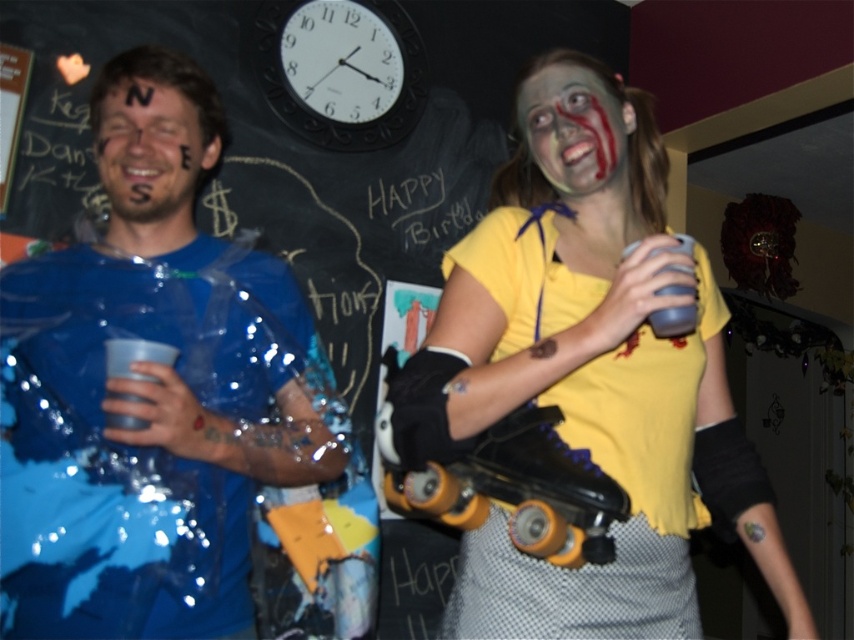
Question: Which object appears closest to the camera in this image?

Choices:
 (A) matte white face at upper right
 (B) blue shiny plastic cup at left

Answer: (B)

Question: Can you confirm if yellow matte shirt at upper right is bigger than yellow rubber roller skate at center?

Choices:
 (A) no
 (B) yes

Answer: (B)

Question: Among these points, which one is nearest to the camera?

Choices:
 (A) (57, 470)
 (B) (471, 284)
 (C) (120, 205)

Answer: (A)

Question: Does blue shiny plastic cup at left appear on the right side of matte white face at upper right?

Choices:
 (A) no
 (B) yes

Answer: (A)

Question: Which object is positioned farthest from the yellow matte shirt at upper right?

Choices:
 (A) matte blue face at center
 (B) yellow rubber roller skate at center

Answer: (A)

Question: Is the position of yellow rubber roller skate at center more distant than that of matte blue face at center?

Choices:
 (A) no
 (B) yes

Answer: (A)